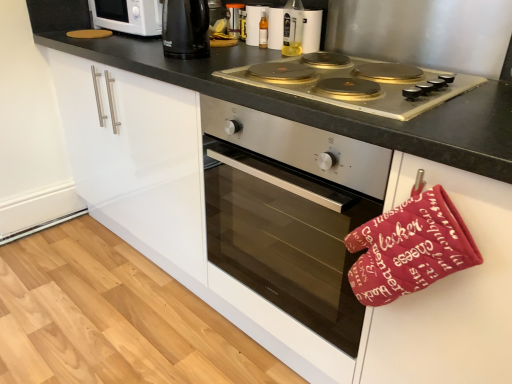
Question: From the image's perspective, does stainless steel oven at center appear lower than white glossy microwave at upper left?

Choices:
 (A) no
 (B) yes

Answer: (B)

Question: From a real-world perspective, is stainless steel oven at center located beneath white glossy microwave at upper left?

Choices:
 (A) yes
 (B) no

Answer: (A)

Question: Can you confirm if stainless steel oven at center is bigger than white glossy microwave at upper left?

Choices:
 (A) no
 (B) yes

Answer: (B)

Question: Is the depth of stainless steel oven at center greater than that of white glossy microwave at upper left?

Choices:
 (A) no
 (B) yes

Answer: (A)

Question: From the image's perspective, is stainless steel oven at center over white glossy microwave at upper left?

Choices:
 (A) yes
 (B) no

Answer: (B)

Question: Is stainless steel oven at center positioned beyond the bounds of white glossy microwave at upper left?

Choices:
 (A) no
 (B) yes

Answer: (B)

Question: Is the depth of white glossy microwave at upper left less than that of stainless steel oven at center?

Choices:
 (A) no
 (B) yes

Answer: (A)

Question: Could you tell me if white glossy microwave at upper left is turned towards stainless steel oven at center?

Choices:
 (A) yes
 (B) no

Answer: (B)

Question: Can you confirm if white glossy microwave at upper left is taller than stainless steel oven at center?

Choices:
 (A) yes
 (B) no

Answer: (B)

Question: Is white glossy microwave at upper left behind stainless steel oven at center?

Choices:
 (A) no
 (B) yes

Answer: (B)

Question: Is white glossy microwave at upper left oriented away from stainless steel oven at center?

Choices:
 (A) yes
 (B) no

Answer: (B)

Question: Considering the relative sizes of white glossy microwave at upper left and stainless steel oven at center in the image provided, is white glossy microwave at upper left wider than stainless steel oven at center?

Choices:
 (A) yes
 (B) no

Answer: (B)

Question: From the image's perspective, does translucent plastic bottle at upper center, which ranks as the 2th bottle in back-to-front order, appear lower than white glossy microwave at upper left?

Choices:
 (A) no
 (B) yes

Answer: (B)